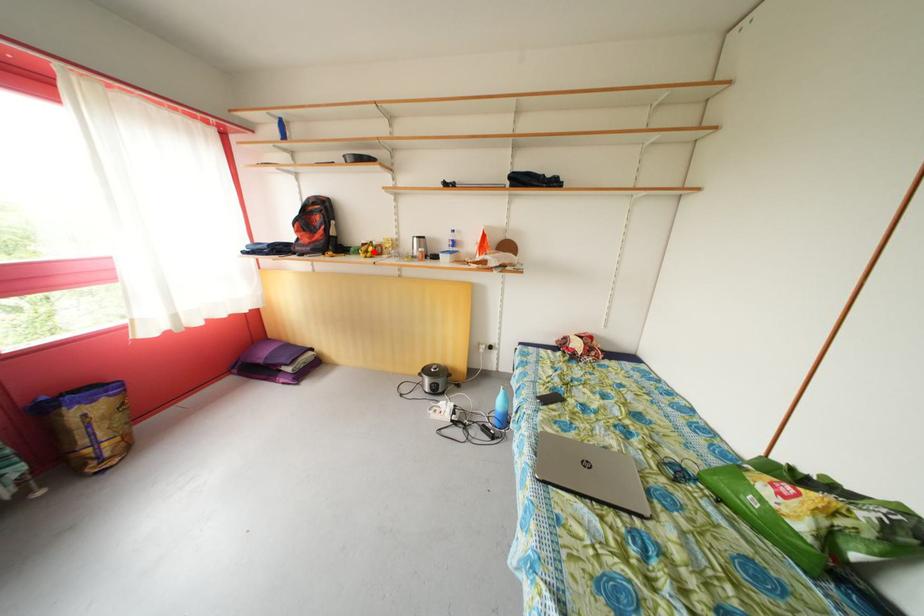
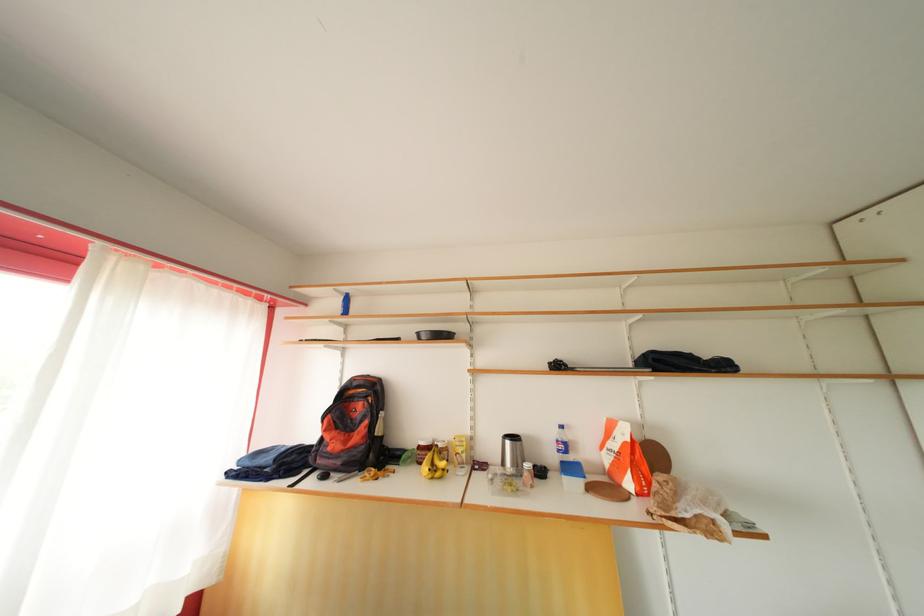
Question: I am providing you with two images of the same scene from different viewpoints. Given a red point in image1, look at the same physical point in image2. Is it:

Choices:
 (A) Closer to the viewpoint
 (B) Farther from the viewpoint

Answer: (B)